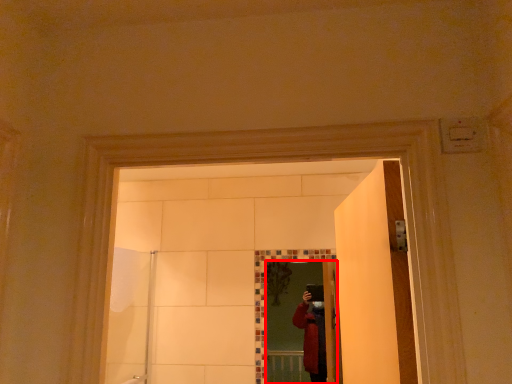
Question: From the image's perspective, considering the relative positions of mirror (annotated by the red box) and shower door in the image provided, where is mirror (annotated by the red box) located with respect to the staircase?

Choices:
 (A) below
 (B) above

Answer: (A)